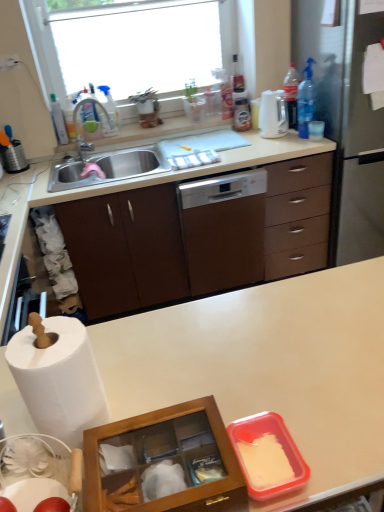
Image resolution: width=384 pixels, height=512 pixels. What do you see at coordinates (109, 113) in the screenshot? I see `transparent plastic spray bottle at upper left, the 2th bottle when ordered from left to right` at bounding box center [109, 113].

What do you see at coordinates (346, 122) in the screenshot? Image resolution: width=384 pixels, height=512 pixels. I see `satin silver fridge at right` at bounding box center [346, 122].

I want to click on clear plastic bottle at upper right, which is counted as the second bottle, starting from the right, so click(x=291, y=95).

Locate an element on the screen. The height and width of the screenshot is (512, 384). translucent plastic bottle at upper left, acting as the 4th bottle starting from the right is located at coordinates (58, 120).

Measure the distance between translucent plastic bottle at upper left, arranged as the 1th bottle when viewed from the left, and camera.

7.98 feet.

The image size is (384, 512). What are the coordinates of `transparent plastic spray bottle at upper left, positioned as the 3th bottle in right-to-left order` in the screenshot? It's located at (109, 113).

In the image, is white paper at left positioned in front of or behind satin silver fridge at right?

white paper at left is positioned closer to the viewer than satin silver fridge at right.

Is white paper at left shorter than satin silver fridge at right?

Yes, white paper at left is shorter than satin silver fridge at right.

Is white paper at left far from satin silver fridge at right?

white paper at left is positioned a significant distance from satin silver fridge at right.

Considering the sizes of objects transparent plastic spray bottle at upper left, the 2th bottle when ordered from left to right, and clear plastic bottle at upper right, which is counted as the second bottle, starting from the right, in the image provided, who is shorter, transparent plastic spray bottle at upper left, the 2th bottle when ordered from left to right, or clear plastic bottle at upper right, which is counted as the second bottle, starting from the right,?

transparent plastic spray bottle at upper left, the 2th bottle when ordered from left to right.

From a real-world perspective, between transparent plastic spray bottle at upper left, positioned as the 3th bottle in right-to-left order, and clear plastic bottle at upper right, which is counted as the second bottle, starting from the right, who is vertically higher?

clear plastic bottle at upper right, which is counted as the second bottle, starting from the right.

From the image's perspective, is transparent plastic spray bottle at upper left, positioned as the 3th bottle in right-to-left order, beneath clear plastic bottle at upper right, which appears as the 3th bottle when viewed from the left?

Correct, transparent plastic spray bottle at upper left, positioned as the 3th bottle in right-to-left order, appears lower than clear plastic bottle at upper right, which appears as the 3th bottle when viewed from the left, in the image.

From a real-world perspective, which is physically below, white matte countertop at center or satin silver fridge at right?

In real-world perspective, white matte countertop at center is lower.

Does white matte countertop at center appear on the left side of satin silver fridge at right?

Indeed, white matte countertop at center is positioned on the left side of satin silver fridge at right.

Is there a large distance between white matte countertop at center and satin silver fridge at right?

That's right, there is a large distance between white matte countertop at center and satin silver fridge at right.

Which is behind, point (275, 411) or point (350, 179)?

The point (350, 179) is more distant.

Where is `bottle that is the 4th object above the white paper at left (from a real-world perspective)`? Image resolution: width=384 pixels, height=512 pixels. bottle that is the 4th object above the white paper at left (from a real-world perspective) is located at coordinates (58, 120).

Between translucent plastic bottle at upper left, arranged as the 1th bottle when viewed from the left, and white paper at left, which one has more height?

Standing taller between the two is translucent plastic bottle at upper left, arranged as the 1th bottle when viewed from the left.

Is point (59, 106) less distant than point (70, 362)?

No, (59, 106) is further to viewer.

From a real-world perspective, which is physically above, translucent plastic bottle at upper left, arranged as the 1th bottle when viewed from the left, or white paper at left?

translucent plastic bottle at upper left, arranged as the 1th bottle when viewed from the left.

Is white matte countertop at center turned away from white glossy dishwasher at center?

white matte countertop at center does not have its back to white glossy dishwasher at center.

Looking at this image, from the image's perspective, is white matte countertop at center under white glossy dishwasher at center?

Yes, from the image's perspective, white matte countertop at center is beneath white glossy dishwasher at center.

Does white matte countertop at center contain white glossy dishwasher at center?

No, white glossy dishwasher at center is not a part of white matte countertop at center.

Is wooden glass at center facing towards transparent glass window at upper center?

No, wooden glass at center is not aimed at transparent glass window at upper center.

Is wooden glass at center wider than transparent glass window at upper center?

No, wooden glass at center is not wider than transparent glass window at upper center.

Considering the positions of objects wooden glass at center and transparent glass window at upper center in the image provided, who is more to the right, wooden glass at center or transparent glass window at upper center?

wooden glass at center is more to the right.

From the image's perspective, is wooden glass at center on top of transparent glass window at upper center?

Actually, wooden glass at center appears below transparent glass window at upper center in the image.

How different are the orientations of translucent plastic bottle at upper left, acting as the 4th bottle starting from the right, and brushed metal grater at left in degrees?

The angular difference between translucent plastic bottle at upper left, acting as the 4th bottle starting from the right, and brushed metal grater at left is 2.17 degrees.

Is translucent plastic bottle at upper left, acting as the 4th bottle starting from the right, oriented away from brushed metal grater at left?

No, brushed metal grater at left is not at the back of translucent plastic bottle at upper left, acting as the 4th bottle starting from the right.

Is translucent plastic bottle at upper left, arranged as the 1th bottle when viewed from the left, touching brushed metal grater at left?

translucent plastic bottle at upper left, arranged as the 1th bottle when viewed from the left, is not next to brushed metal grater at left, and they're not touching.

Where is `paper towel in front of the satin silver fridge at right`? paper towel in front of the satin silver fridge at right is located at coordinates (59, 379).

Locate an element on the screen. the 1st bottle counting from the right side of the transparent plastic spray bottle at upper left, the 2th bottle when ordered from left to right is located at coordinates (291, 95).

Estimate the real-world distances between objects in this image. Which object is further from white paper at left, white glossy electric kettle at upper right or blue translucent bottle at upper right, which appears as the fourth bottle when viewed from the left?

The object further to white paper at left is blue translucent bottle at upper right, which appears as the fourth bottle when viewed from the left.

Based on their spatial positions, is wooden glass at center or white matte countertop at center closer to matte silver faucet at sink left?

Among the two, white matte countertop at center is located nearer to matte silver faucet at sink left.

From the image, which object appears to be farther from transparent plastic spray bottle at upper left, the 2th bottle when ordered from left to right, white glossy electric kettle at upper right or white matte countertop at center?

Based on the image, white matte countertop at center appears to be further to transparent plastic spray bottle at upper left, the 2th bottle when ordered from left to right.

Estimate the real-world distances between objects in this image. Which object is closer to white glossy electric kettle at upper right, white paper at left or clear plastic bottle at upper right, which appears as the 3th bottle when viewed from the left?

The object closer to white glossy electric kettle at upper right is clear plastic bottle at upper right, which appears as the 3th bottle when viewed from the left.

Considering their positions, is wooden glass at center positioned closer to white matte countertop at center than brown wood cabinet at left?

wooden glass at center lies closer to white matte countertop at center than the other object.

Considering their positions, is white paper at left positioned further to brushed metal grater at left than brown wood cabinet at left?

white paper at left is further to brushed metal grater at left.

Consider the image. Estimate the real-world distances between objects in this image. Which object is further from wooden glass at center, translucent plastic bottle at upper left, arranged as the 1th bottle when viewed from the left, or transparent glass window at upper center?

Based on the image, transparent glass window at upper center appears to be further to wooden glass at center.

Which object lies further to the anchor point white glossy electric kettle at upper right, white matte countertop at center or transparent glass window at upper center?

Among the two, white matte countertop at center is located further to white glossy electric kettle at upper right.

The image size is (384, 512). I want to click on paper towel between white matte countertop at center and brown wood cabinet at left in the front-back direction, so click(59, 379).

This screenshot has height=512, width=384. I want to click on cabinetry between matte silver faucet at sink left and clear plastic bottle at upper right, which appears as the 3th bottle when viewed from the left, from left to right, so click(125, 249).

I want to click on kitchen appliance between blue translucent bottle at upper right, which ranks as the 1th bottle in right-to-left order, and clear plastic bottle at upper right, which appears as the 3th bottle when viewed from the left, along the z-axis, so click(273, 114).

Identify the location of home appliance between brushed metal grater at left and blue translucent bottle at upper right, which appears as the fourth bottle when viewed from the left. (224, 230).